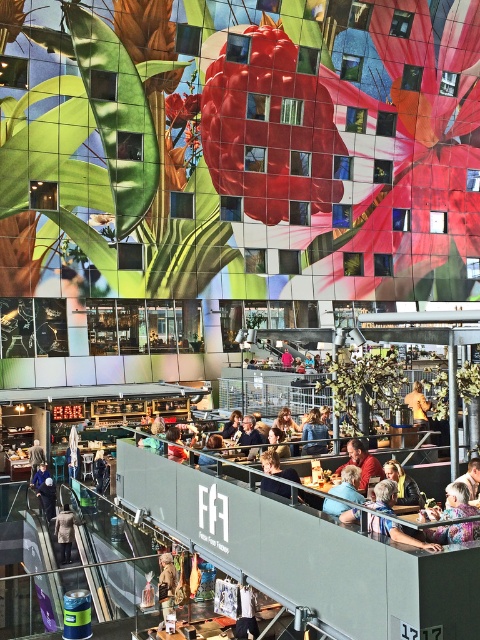
Question: Is light brown leather jacket at upper center to the right of smooth brown hair at center from the viewer's perspective?

Choices:
 (A) yes
 (B) no

Answer: (A)

Question: Where is dark gray wool coat at lower left located in relation to denim jacket at lower left in the image?

Choices:
 (A) below
 (B) above

Answer: (A)

Question: Which point is farther to the camera?

Choices:
 (A) (365, 468)
 (B) (38, 452)

Answer: (B)

Question: Which point appears farthest from the camera in this image?

Choices:
 (A) pos(173,456)
 (B) pos(68,552)
 (C) pos(37,451)
 (D) pos(165,586)

Answer: (C)

Question: Is blue denim jacket at center to the left of matte green leaf at center from the viewer's perspective?

Choices:
 (A) yes
 (B) no

Answer: (B)

Question: Which point is closer to the camera?

Choices:
 (A) golden hair at upper center
 (B) light brown leather jacket at upper center
 (C) matte green leaf at center
 (D) plaid fabric jacket at lower right

Answer: (D)